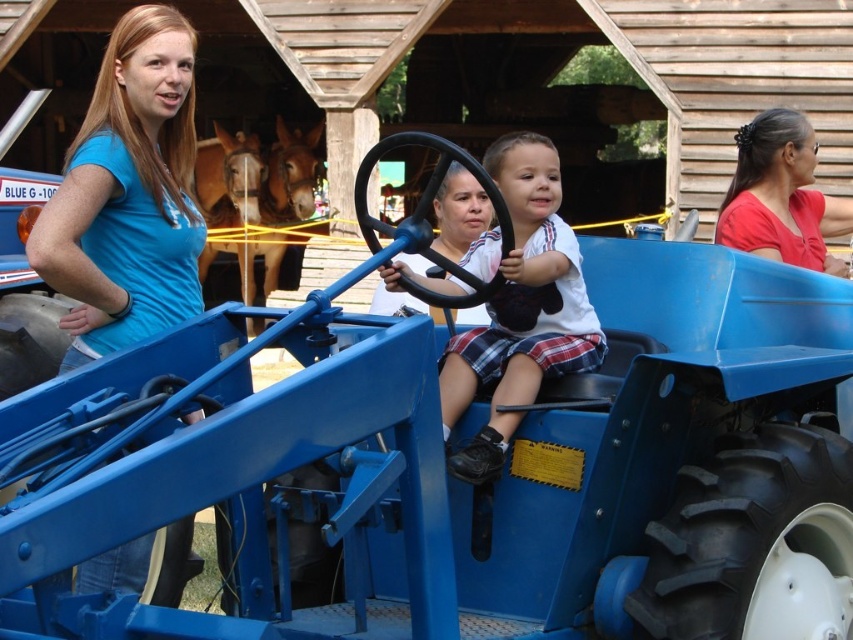
Question: Estimate the real-world distances between objects in this image. Which object is farther from the blue t-shirt at upper left?

Choices:
 (A) matte blue tractor at center
 (B) matte red shirt at right

Answer: (B)

Question: Which point is farther to the camera?

Choices:
 (A) (514, 394)
 (B) (749, 140)

Answer: (B)

Question: Considering the relative positions of blue t-shirt at upper left and matte blue tractor at center in the image provided, where is blue t-shirt at upper left located with respect to matte blue tractor at center?

Choices:
 (A) above
 (B) below

Answer: (A)

Question: Which point appears closest to the camera in this image?

Choices:
 (A) (503, 451)
 (B) (785, 225)
 (C) (125, 285)

Answer: (A)

Question: Considering the relative positions of blue t-shirt at upper left and matte blue tractor at center in the image provided, where is blue t-shirt at upper left located with respect to matte blue tractor at center?

Choices:
 (A) above
 (B) below

Answer: (A)

Question: Can you confirm if matte blue tractor at center is smaller than matte red shirt at right?

Choices:
 (A) no
 (B) yes

Answer: (B)